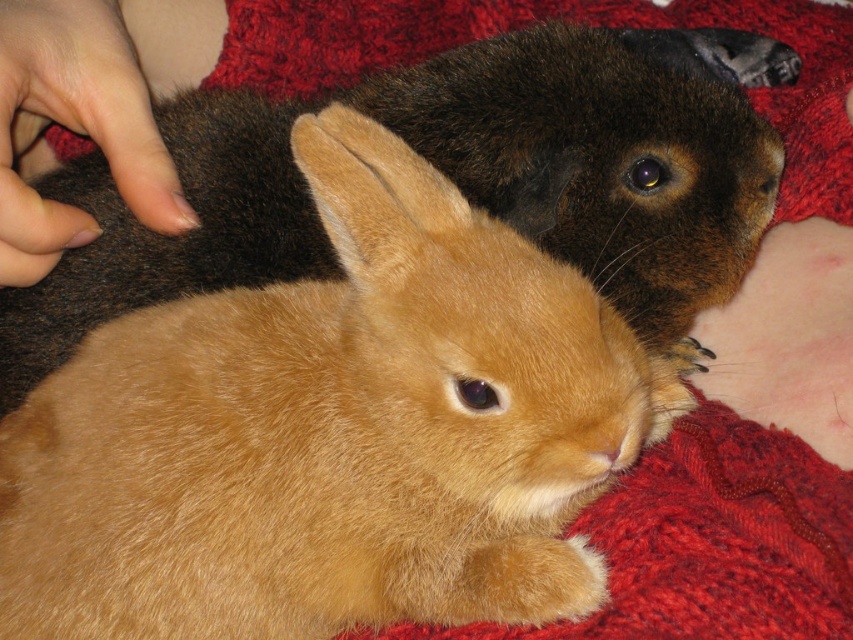
Does golden fur rabbit at center have a greater height compared to nail polish at upper left?

Correct, golden fur rabbit at center is much taller as nail polish at upper left.

Between point (390, 113) and point (80, 29), which one is positioned in front?

Point (80, 29)

The image size is (853, 640). I want to click on golden fur rabbit at center, so click(x=456, y=180).

Who is taller, soft brown fur rabbit at center or nail polish at upper left?

Standing taller between the two is soft brown fur rabbit at center.

Is soft brown fur rabbit at center thinner than nail polish at upper left?

No, soft brown fur rabbit at center is not thinner than nail polish at upper left.

Which is in front, point (224, 582) or point (136, 74)?

Point (224, 582) is more forward.

The image size is (853, 640). What are the coordinates of `soft brown fur rabbit at center` in the screenshot? It's located at (332, 433).

Which of these two, soft brown fur rabbit at center or golden fur rabbit at center, stands taller?

golden fur rabbit at center is taller.

Between soft brown fur rabbit at center and golden fur rabbit at center, which one is positioned higher?

golden fur rabbit at center

Does point (223, 477) lie behind point (1, 342)?

No, (223, 477) is closer to viewer.

Locate an element on the screen. The image size is (853, 640). soft brown fur rabbit at center is located at coordinates (332, 433).